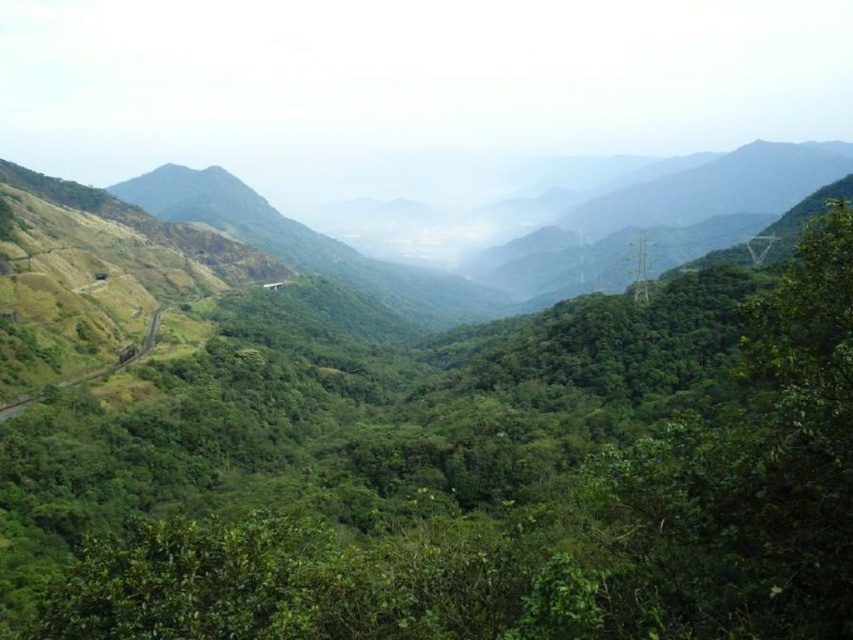
Question: Which point is farther to the camera?

Choices:
 (A) green leafy vegetation at center
 (B) green grassy mountain path at left

Answer: (B)

Question: Can you confirm if green leafy vegetation at center is positioned above green grassy mountain path at left?

Choices:
 (A) no
 (B) yes

Answer: (A)

Question: Can you confirm if green leafy vegetation at center is wider than green grassy mountain path at left?

Choices:
 (A) no
 (B) yes

Answer: (B)

Question: Does green leafy vegetation at center appear on the right side of green grassy mountain path at left?

Choices:
 (A) yes
 (B) no

Answer: (A)

Question: Which point is farther to the camera?

Choices:
 (A) green leafy vegetation at center
 (B) green grassy mountain path at left

Answer: (B)

Question: Which point is farther to the camera?

Choices:
 (A) green leafy vegetation at center
 (B) green grassy mountain path at left

Answer: (B)